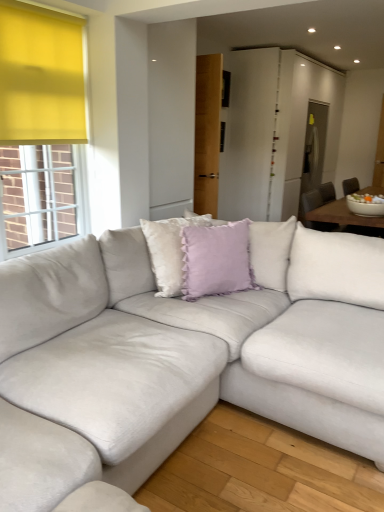
The height and width of the screenshot is (512, 384). What do you see at coordinates (169, 251) in the screenshot? I see `lavender velvet pillow at center, the second pillow when ordered from right to left` at bounding box center [169, 251].

Identify the location of lavender velvet pillow at center, the 1th pillow from the left. (169, 251).

The width and height of the screenshot is (384, 512). I want to click on lavender velvet cushion at center, the 2th pillow from the left, so click(x=216, y=260).

In the image, is suede white couch at center positioned in front of or behind lavender velvet cushion at center, the 2th pillow from the left?

Clearly, suede white couch at center is in front of lavender velvet cushion at center, the 2th pillow from the left.

This screenshot has height=512, width=384. In order to click on the 2nd pillow to the right of the suede white couch at center, counting from the anchor's position in this screenshot , I will do `click(216, 260)`.

Considering the positions of points (34, 411) and (209, 237), is point (34, 411) closer to camera compared to point (209, 237)?

Yes, point (34, 411) is in front of point (209, 237).

Considering the relative sizes of lavender velvet cushion at center, acting as the first pillow starting from the right, and suede white couch at center in the image provided, is lavender velvet cushion at center, acting as the first pillow starting from the right, smaller than suede white couch at center?

Indeed, lavender velvet cushion at center, acting as the first pillow starting from the right, has a smaller size compared to suede white couch at center.

Is lavender velvet cushion at center, the 2th pillow from the left, to the left of suede white couch at center from the viewer's perspective?

Incorrect, lavender velvet cushion at center, the 2th pillow from the left, is not on the left side of suede white couch at center.

Can you tell me how much lavender velvet cushion at center, the 2th pillow from the left, and suede white couch at center differ in facing direction?

lavender velvet cushion at center, the 2th pillow from the left, and suede white couch at center are facing 33.9 degrees away from each other.

From the image's perspective, relative to suede white couch at center, is lavender velvet cushion at center, acting as the first pillow starting from the right, above or below?

From the image's perspective, lavender velvet cushion at center, acting as the first pillow starting from the right, appears above suede white couch at center.

Is lavender velvet pillow at center, the 1th pillow from the left, to the left or to the right of lavender velvet cushion at center, acting as the first pillow starting from the right, in the image?

lavender velvet pillow at center, the 1th pillow from the left, is positioned on lavender velvet cushion at center, acting as the first pillow starting from the right,'s left side.

Between lavender velvet pillow at center, the 1th pillow from the left, and lavender velvet cushion at center, acting as the first pillow starting from the right, which one has larger width?

Wider between the two is lavender velvet pillow at center, the 1th pillow from the left.

Considering the relative sizes of lavender velvet pillow at center, the 1th pillow from the left, and lavender velvet cushion at center, acting as the first pillow starting from the right, in the image provided, is lavender velvet pillow at center, the 1th pillow from the left, taller than lavender velvet cushion at center, acting as the first pillow starting from the right,?

Yes.

I want to click on pillow above the lavender velvet cushion at center, acting as the first pillow starting from the right (from the image's perspective), so click(169, 251).

Is lavender velvet cushion at center, acting as the first pillow starting from the right, oriented towards lavender velvet pillow at center, the 1th pillow from the left?

No.

Considering the relative positions of lavender velvet cushion at center, acting as the first pillow starting from the right, and lavender velvet pillow at center, the 1th pillow from the left, in the image provided, is lavender velvet cushion at center, acting as the first pillow starting from the right, in front of lavender velvet pillow at center, the 1th pillow from the left,?

That is False.

Where is `pillow below the lavender velvet pillow at center, the 1th pillow from the left (from the image's perspective)`? Image resolution: width=384 pixels, height=512 pixels. pillow below the lavender velvet pillow at center, the 1th pillow from the left (from the image's perspective) is located at coordinates (216, 260).

Is lavender velvet cushion at center, the 2th pillow from the left, thinner than lavender velvet pillow at center, the second pillow when ordered from right to left?

Indeed, lavender velvet cushion at center, the 2th pillow from the left, has a lesser width compared to lavender velvet pillow at center, the second pillow when ordered from right to left.

Measure the distance from suede white couch at center to lavender velvet pillow at center, the second pillow when ordered from right to left.

suede white couch at center and lavender velvet pillow at center, the second pillow when ordered from right to left, are 21.88 inches apart.

Is suede white couch at center facing away from lavender velvet pillow at center, the second pillow when ordered from right to left?

Yes, suede white couch at center's orientation is away from lavender velvet pillow at center, the second pillow when ordered from right to left.

From the image's perspective, is suede white couch at center on lavender velvet pillow at center, the second pillow when ordered from right to left?

No, from the image's perspective, suede white couch at center is not on top of lavender velvet pillow at center, the second pillow when ordered from right to left.

Considering the sizes of objects suede white couch at center and lavender velvet pillow at center, the 1th pillow from the left, in the image provided, who is shorter, suede white couch at center or lavender velvet pillow at center, the 1th pillow from the left,?

lavender velvet pillow at center, the 1th pillow from the left.

Who is taller, lavender velvet pillow at center, the 1th pillow from the left, or suede white couch at center?

suede white couch at center is taller.

Which is correct: lavender velvet pillow at center, the second pillow when ordered from right to left, is inside suede white couch at center, or outside of it?

lavender velvet pillow at center, the second pillow when ordered from right to left, lies within the bounds of suede white couch at center.

Which is farther, [176,249] or [289,362]?

Positioned behind is point [176,249].

Based on their positions, is lavender velvet pillow at center, the 1th pillow from the left, located to the left or right of suede white couch at center?

Clearly, lavender velvet pillow at center, the 1th pillow from the left, is on the right of suede white couch at center in the image.

At what (x,y) coordinates should I click in order to perform the action: click on the 2nd pillow counting from the right side of the suede white couch at center. Please return your answer as a coordinate pair (x, y). This screenshot has width=384, height=512. Looking at the image, I should click on (216, 260).

This screenshot has height=512, width=384. What are the coordinates of `studio couch that is in front of the lavender velvet cushion at center, the 2th pillow from the left` in the screenshot? It's located at (180, 357).

Based on their spatial positions, is lavender velvet pillow at center, the 1th pillow from the left, or suede white couch at center closer to lavender velvet cushion at center, acting as the first pillow starting from the right?

Based on the image, lavender velvet pillow at center, the 1th pillow from the left, appears to be nearer to lavender velvet cushion at center, acting as the first pillow starting from the right.

Based on their spatial positions, is suede white couch at center or lavender velvet cushion at center, acting as the first pillow starting from the right, closer to lavender velvet pillow at center, the 1th pillow from the left?

The object closer to lavender velvet pillow at center, the 1th pillow from the left, is lavender velvet cushion at center, acting as the first pillow starting from the right.

Considering their positions, is suede white couch at center positioned further to lavender velvet cushion at center, acting as the first pillow starting from the right, than lavender velvet pillow at center, the second pillow when ordered from right to left?

suede white couch at center is positioned further to the anchor lavender velvet cushion at center, acting as the first pillow starting from the right.

Based on their spatial positions, is lavender velvet cushion at center, the 2th pillow from the left, or suede white couch at center closer to lavender velvet pillow at center, the 1th pillow from the left?

lavender velvet cushion at center, the 2th pillow from the left.

When comparing their distances from suede white couch at center, does lavender velvet pillow at center, the 1th pillow from the left, or lavender velvet cushion at center, acting as the first pillow starting from the right, seem further?

Based on the image, lavender velvet pillow at center, the 1th pillow from the left, appears to be further to suede white couch at center.

Looking at this image, estimate the real-world distances between objects in this image. Which object is further from suede white couch at center, lavender velvet cushion at center, the 2th pillow from the left, or lavender velvet pillow at center, the second pillow when ordered from right to left?

lavender velvet pillow at center, the second pillow when ordered from right to left.

You are a GUI agent. You are given a task and a screenshot of the screen. Output one action in this format:
    pyautogui.click(x=<x>, y=<y>)
    Task: Click on the pillow between suede white couch at center and lavender velvet cushion at center, the 2th pillow from the left, along the z-axis
    Image resolution: width=384 pixels, height=512 pixels.
    Given the screenshot: What is the action you would take?
    pyautogui.click(x=169, y=251)